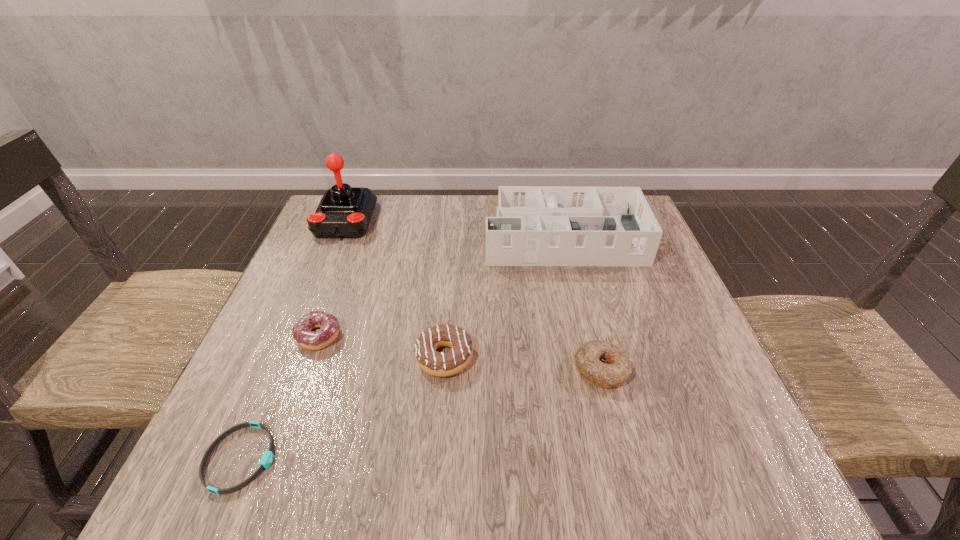
The width and height of the screenshot is (960, 540). Find the location of `free space between the leftmost doughnut and the tallest object`. free space between the leftmost doughnut and the tallest object is located at coordinates point(332,279).

I want to click on unoccupied position between the shortest object and the rightmost doughnut, so click(421, 414).

Where is `vacant space in between the fourth object from left to right and the leftmost doughnut`? vacant space in between the fourth object from left to right and the leftmost doughnut is located at coordinates (381, 347).

The image size is (960, 540). What are the coordinates of `unoccupied area between the shortest object and the joystick` in the screenshot? It's located at (293, 340).

Where is `free space between the rightmost doughnut and the dollhouse`? Image resolution: width=960 pixels, height=540 pixels. free space between the rightmost doughnut and the dollhouse is located at coordinates (581, 302).

Where is `vacant area that lies between the leftmost doughnut and the tallest object`? The height and width of the screenshot is (540, 960). vacant area that lies between the leftmost doughnut and the tallest object is located at coordinates (332, 279).

This screenshot has height=540, width=960. Find the location of `object that is the closest to the leftmost doughnut`. object that is the closest to the leftmost doughnut is located at coordinates (267, 458).

Identify which object is the second nearest to the fourth object from left to right. Please provide its 2D coordinates. Your answer should be formatted as a tuple, i.e. [(x, y)], where the tuple contains the x and y coordinates of a point satisfying the conditions above.

[(602, 364)]

Where is `doughnut object that ranks as the second closest to the second doughnut from right to left`? Image resolution: width=960 pixels, height=540 pixels. doughnut object that ranks as the second closest to the second doughnut from right to left is located at coordinates (602, 364).

Point out which doughnut is positioned as the second nearest to the joystick. Please provide its 2D coordinates. Your answer should be formatted as a tuple, i.e. [(x, y)], where the tuple contains the x and y coordinates of a point satisfying the conditions above.

[(435, 363)]